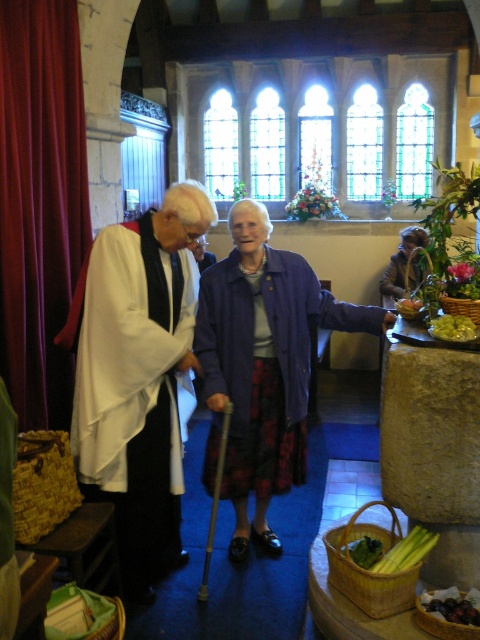
Question: Can you confirm if white clothed figure at left is wider than white matte vestment at center?

Choices:
 (A) yes
 (B) no

Answer: (A)

Question: Can you confirm if white matte vestment at center is positioned to the left of velvet deep red curtain at left?

Choices:
 (A) yes
 (B) no

Answer: (B)

Question: Estimate the real-world distances between objects in this image. Which object is closer to the white matte vestment at center?

Choices:
 (A) white clothed figure at left
 (B) velvet brown coat at center
 (C) velvet deep red curtain at left

Answer: (A)

Question: Which point appears farthest from the camera in this image?

Choices:
 (A) (108, 436)
 (B) (32, 340)
 (C) (120, 260)
 (D) (394, 272)

Answer: (D)

Question: Is white clothed figure at left smaller than purple fabric coat at center?

Choices:
 (A) yes
 (B) no

Answer: (B)

Question: Based on their relative distances, which object is farther from the velvet deep red curtain at left?

Choices:
 (A) velvet brown coat at center
 (B) white matte vestment at center
 (C) white clothed figure at left

Answer: (A)